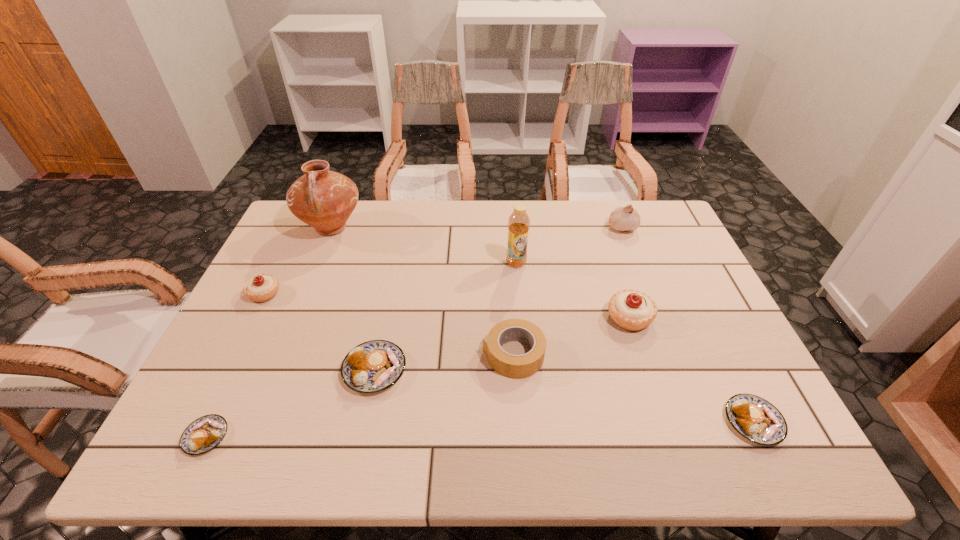
Locate an element on the screen. Image resolution: width=960 pixels, height=540 pixels. the rightmost pastry is located at coordinates (756, 419).

I want to click on the rightmost brown pastry, so click(756, 419).

At what (x,y) coordinates should I click in order to perform the action: click on the shortest object. Please return your answer as a coordinate pair (x, y). This screenshot has height=540, width=960. Looking at the image, I should click on (201, 436).

Find the location of a particular element. This screenshot has height=540, width=960. the shortest pastry is located at coordinates (201, 436).

You are a GUI agent. You are given a task and a screenshot of the screen. Output one action in this format:
    pyautogui.click(x=<x>, y=<y>)
    Task: Click on the free space located 0.060m on the side of the pottery with the handle
    Image resolution: width=960 pixels, height=540 pixels.
    Given the screenshot: What is the action you would take?
    pyautogui.click(x=318, y=261)

Find the location of `free spot located 0.070m on the back of the third farthest object`. free spot located 0.070m on the back of the third farthest object is located at coordinates 515,242.

Locate an element on the screen. This screenshot has width=960, height=540. free space located 0.350m on the left of the garlic is located at coordinates (500, 227).

The width and height of the screenshot is (960, 540). I want to click on vacant region located 0.260m on the back of the right beige pastry, so click(605, 242).

Identify the location of free space located on the right of the fourth shortest pastry. Image resolution: width=960 pixels, height=540 pixels. [346, 294].

The height and width of the screenshot is (540, 960). In order to click on free space located 0.390m at the edge of the duct tape in this screenshot , I will do `click(323, 355)`.